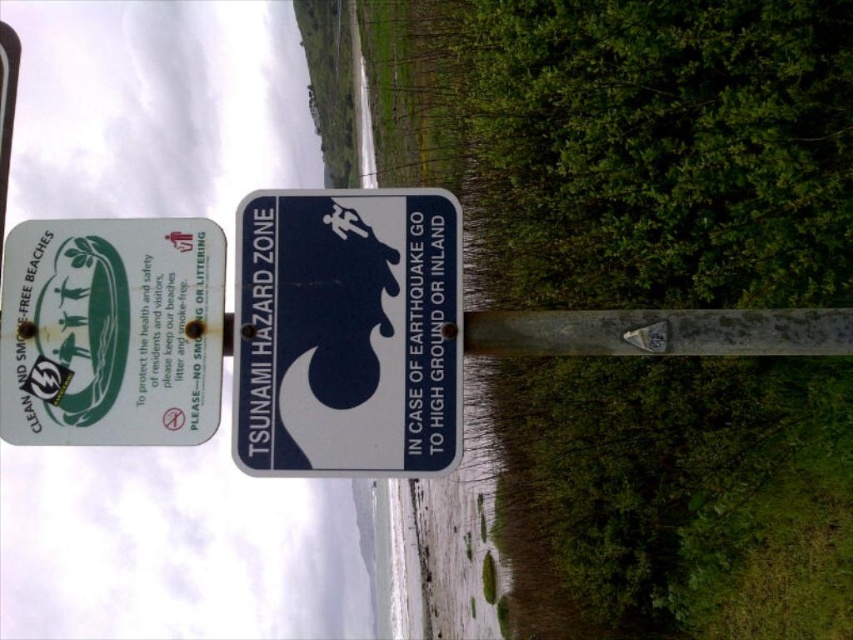
Based on the photo, who is lower down, white plastic sign at center or green paper sign at upper left?

green paper sign at upper left

Which of these two, white plastic sign at center or green paper sign at upper left, stands taller?

With more height is white plastic sign at center.

Between point (450, 340) and point (35, 221), which one is positioned behind?

Point (35, 221)

Identify the location of white plastic sign at center. (347, 332).

Describe the element at coordinates (347, 332) in the screenshot. I see `white plastic sign at center` at that location.

Can you confirm if white plastic sign at center is positioned above metallic reflective sticker at upper left?

Yes.

Who is more distant from viewer, (329, 236) or (51, 380)?

The point (329, 236) is behind.

I want to click on white plastic sign at center, so point(347,332).

Between point (15, 440) and point (57, 380), which one is positioned behind?

The point (57, 380) is more distant.

Who is positioned more to the right, green paper sign at upper left or metallic reflective sticker at upper left?

Positioned to the right is green paper sign at upper left.

Between point (201, 339) and point (45, 371), which one is positioned in front?

Point (45, 371) is in front.

The image size is (853, 640). In order to click on green paper sign at upper left in this screenshot , I will do `click(111, 332)`.